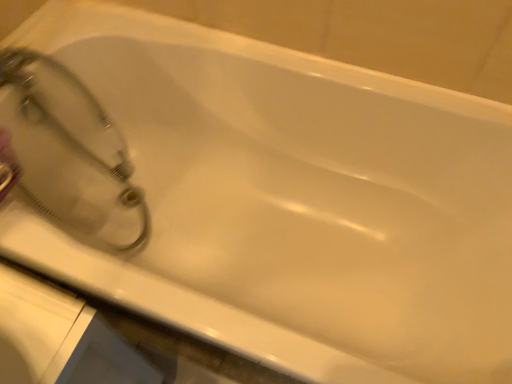
The image size is (512, 384). Identify the location of satin chrome showerhead at left. (71, 151).

Describe the element at coordinates (71, 151) in the screenshot. I see `satin chrome showerhead at left` at that location.

I want to click on satin chrome showerhead at left, so click(71, 151).